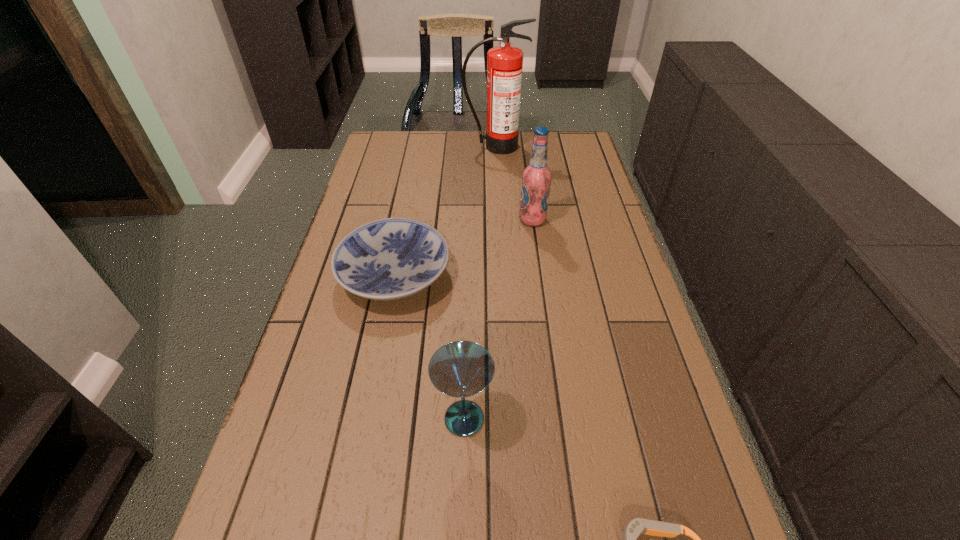
The width and height of the screenshot is (960, 540). Find the location of `fire extinguisher`. fire extinguisher is located at coordinates (504, 63).

What are the coordinates of `the farthest object` in the screenshot? It's located at pos(504,63).

Where is `the fourth nearest object`? the fourth nearest object is located at coordinates (536, 178).

The width and height of the screenshot is (960, 540). I want to click on alcohol, so click(536, 178).

Where is `the second nearest object`? This screenshot has width=960, height=540. the second nearest object is located at coordinates (459, 369).

At what (x,y) coordinates should I click in order to perform the action: click on martini. Please return your answer as a coordinate pair (x, y). This screenshot has height=540, width=960. Looking at the image, I should click on (459, 369).

This screenshot has width=960, height=540. What are the coordinates of `plate` in the screenshot? It's located at (393, 258).

The image size is (960, 540). Find the location of `the third farthest object`. the third farthest object is located at coordinates (393, 258).

Where is `free space located on the front-facing side of the tallest object`? This screenshot has width=960, height=540. free space located on the front-facing side of the tallest object is located at coordinates (496, 184).

Where is `free region located on the front of the fourth shortest object`? This screenshot has width=960, height=540. free region located on the front of the fourth shortest object is located at coordinates pos(544,309).